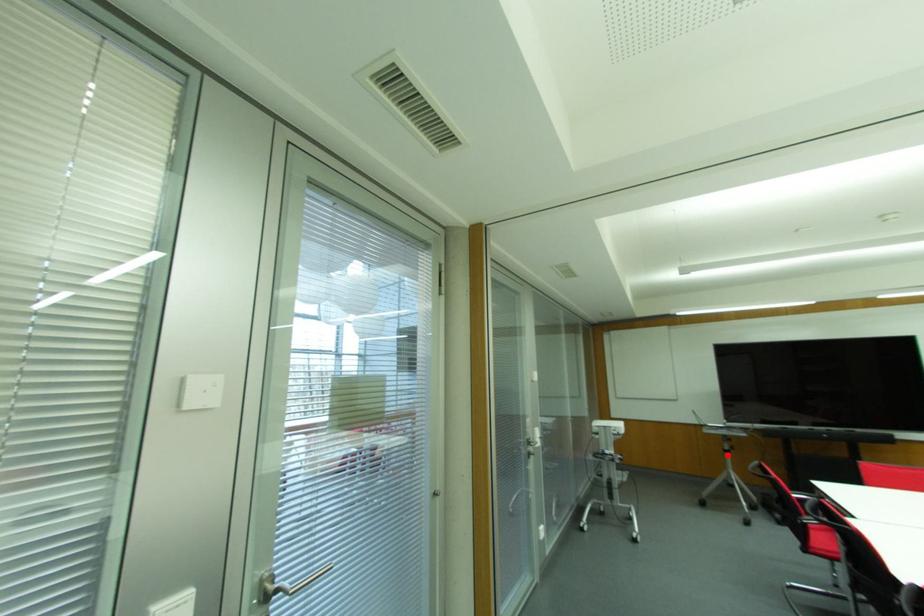
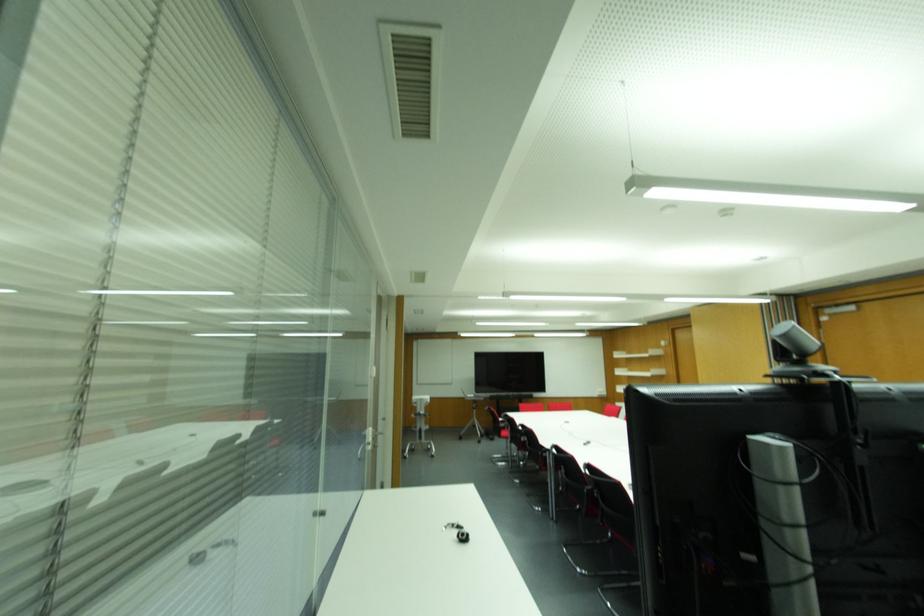
Question: I am providing you with two images of the same scene from different viewpoints. Image1 has a red point marked. In image2, the corresponding 3D location appears at what relative position? Reply with the corresponding letter.

Choices:
 (A) Closer
 (B) Farther

Answer: (B)